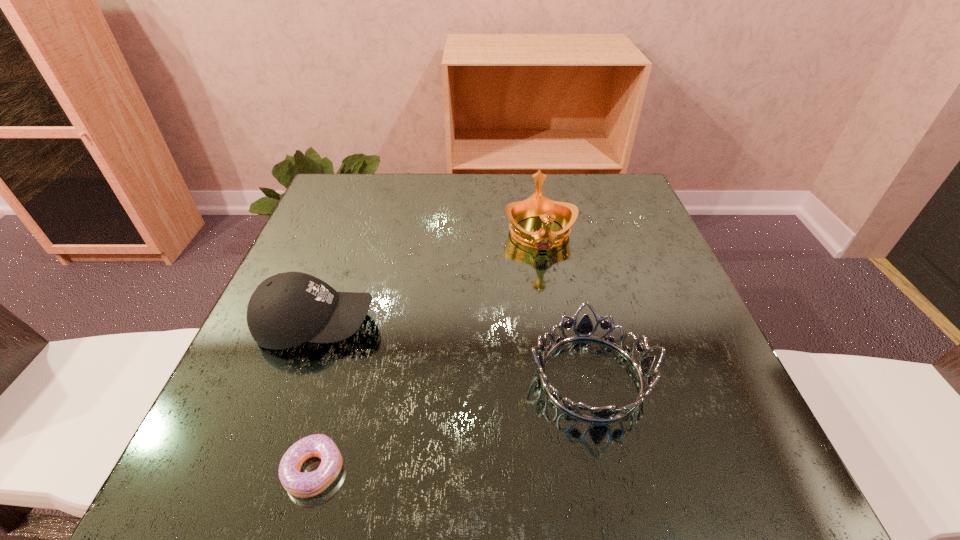
Identify the location of free space at the near edge. The width and height of the screenshot is (960, 540). (415, 476).

Image resolution: width=960 pixels, height=540 pixels. Identify the location of vacant space at the left edge. (244, 374).

You are a GUI agent. You are given a task and a screenshot of the screen. Output one action in this format:
    pyautogui.click(x=<x>, y=<y>)
    Task: Click on the free spot at the right edge of the desktop
    This screenshot has height=540, width=960.
    Given the screenshot: What is the action you would take?
    pyautogui.click(x=623, y=263)

This screenshot has height=540, width=960. Identify the location of free location at the far left corner. (330, 195).

At what (x,y) coordinates should I click in order to perform the action: click on free spot at the far right corner of the desktop. Please return your answer as a coordinate pair (x, y). This screenshot has width=960, height=540. Looking at the image, I should click on pos(626,188).

In the image, there is a desktop. Where is `vacant space at the near right corner`? This screenshot has width=960, height=540. vacant space at the near right corner is located at coordinates (739, 500).

This screenshot has width=960, height=540. In order to click on vacant space that's between the farther tiara and the nearest object in this screenshot , I will do `click(427, 351)`.

I want to click on empty space that is in between the farther tiara and the baseball cap, so click(x=428, y=279).

The width and height of the screenshot is (960, 540). Find the location of `unoccupied area between the shorter tiara and the nearest object`. unoccupied area between the shorter tiara and the nearest object is located at coordinates (453, 423).

Find the location of a particular element. The height and width of the screenshot is (540, 960). vacant space in between the second shortest object and the nearest object is located at coordinates (453, 423).